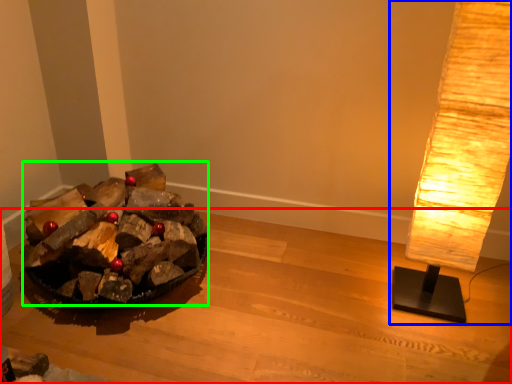
Question: Which object is positioned closest to furniture (highlighted by a red box)? Select from lamp (highlighted by a blue box) and debris (highlighted by a green box).

Choices:
 (A) lamp
 (B) debris

Answer: (B)